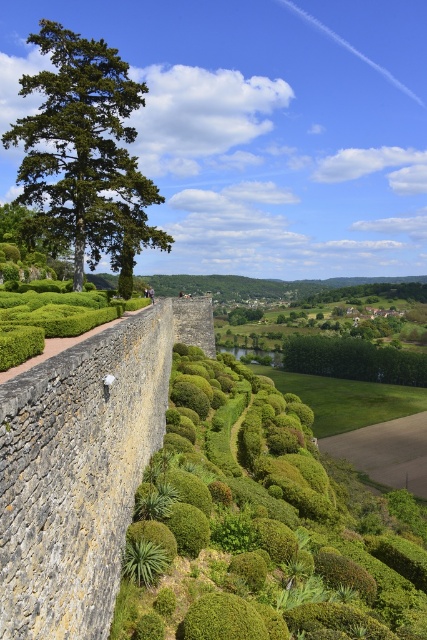
Who is positioned more to the right, green leafy hedge at center or green leafy tree at upper left?

green leafy hedge at center

Is point (192, 436) closer to viewer compared to point (128, 177)?

Yes, point (192, 436) is in front of point (128, 177).

Where is `green leafy hedge at center`? green leafy hedge at center is located at coordinates (263, 528).